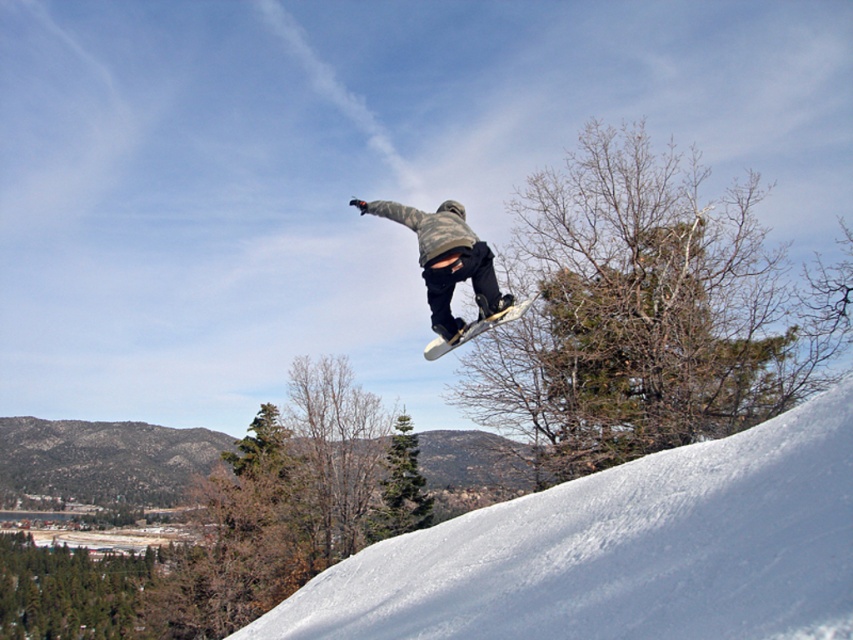
You are a drone operator trying to capture the snowboarder in midair. You have two points marked on your screen for positioning your camera. The first point is at coordinates point (837,525) and the second point is at coordinates point (418,220). Which point should you use to frame the snowboarder so that the camera is closer to them?

Point (837,525) is in front of point (418,220), so you should use point (837,525) to frame the snowboarder as it is closer to them.

You are a drone operator trying to capture aerial footage of the snowboarder. Your drone is currently hovering above the white snow at lower right. To ensure safety, the drone must stay at least 3 meters away from the snowboarder. Is the current distance sufficient?

The distance between the white snow at lower right and the camera is 3.39 meters. Since the drone must stay at least 3 meters away, the current distance of 3.39 meters is sufficient.

You are a snowboarder in the image and you want to land on the white snow at lower right after your jump. Which direction should you aim your white matte snowboard at center towards?

You should aim your white matte snowboard at center towards the left because the white snow at lower right is located to the left of the white matte snowboard at center.